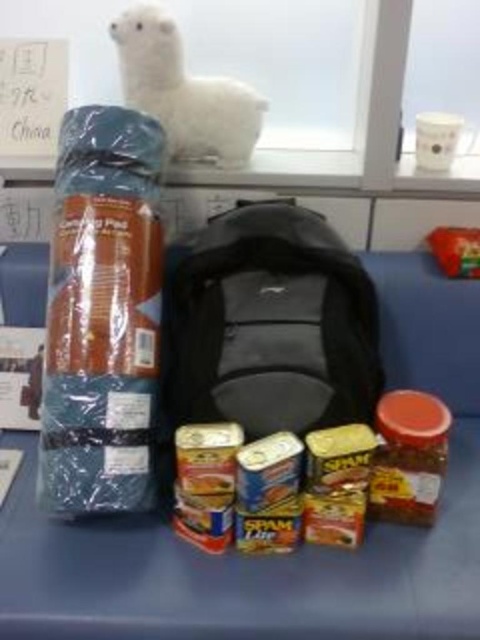
Question: Which object appears closest to the camera in this image?

Choices:
 (A) black fabric backpack at center
 (B) white plush at upper center

Answer: (A)

Question: Among these objects, which one is farthest from the camera?

Choices:
 (A) black fabric backpack at center
 (B) white plush at upper center

Answer: (B)

Question: Which object is closer to the camera taking this photo?

Choices:
 (A) black fabric backpack at center
 (B) white plush at upper center

Answer: (A)

Question: Can you confirm if black fabric backpack at center is smaller than white plush at upper center?

Choices:
 (A) yes
 (B) no

Answer: (B)

Question: Is black fabric backpack at center to the left of white plush at upper center from the viewer's perspective?

Choices:
 (A) yes
 (B) no

Answer: (B)

Question: Is black fabric backpack at center in front of white plush at upper center?

Choices:
 (A) yes
 (B) no

Answer: (A)